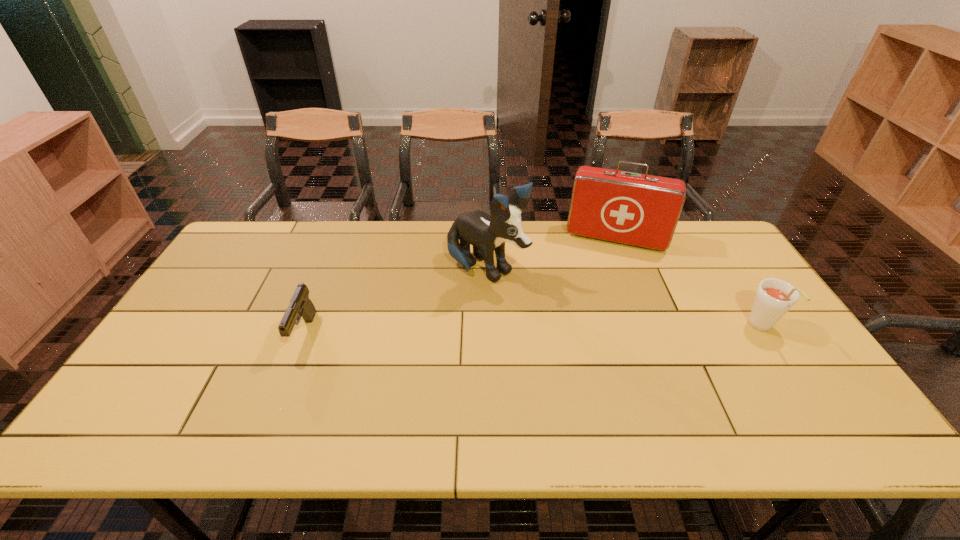
In order to click on vacant space located 0.270m on the front-facing side of the third object from right to left in this screenshot , I will do `click(592, 333)`.

At what (x,y) coordinates should I click in order to perform the action: click on vacant space located 0.360m on the front-facing side of the third object from right to left. Please return your answer as a coordinate pair (x, y). Looking at the image, I should click on (622, 351).

Image resolution: width=960 pixels, height=540 pixels. What are the coordinates of `free spot located 0.350m on the front-facing side of the third object from right to left` in the screenshot? It's located at (618, 349).

Identify the location of free region located on the side of the first-aid kit with the first aid cross symbol. (601, 276).

Image resolution: width=960 pixels, height=540 pixels. I want to click on free space located on the side of the first-aid kit with the first aid cross symbol, so click(603, 269).

Where is `free space located on the side of the first-aid kit with the first aid cross symbol`? free space located on the side of the first-aid kit with the first aid cross symbol is located at coordinates (604, 265).

Image resolution: width=960 pixels, height=540 pixels. In order to click on puppy located in the far edge section of the desktop in this screenshot , I will do `click(487, 234)`.

Find the location of a particular element. This screenshot has width=960, height=540. the first-aid kit present at the far edge is located at coordinates (642, 210).

Where is `object that is positioned at the right edge`? Image resolution: width=960 pixels, height=540 pixels. object that is positioned at the right edge is located at coordinates (x=774, y=298).

This screenshot has height=540, width=960. In the image, there is a desktop. Find the location of `vacant region at the far edge`. vacant region at the far edge is located at coordinates (543, 221).